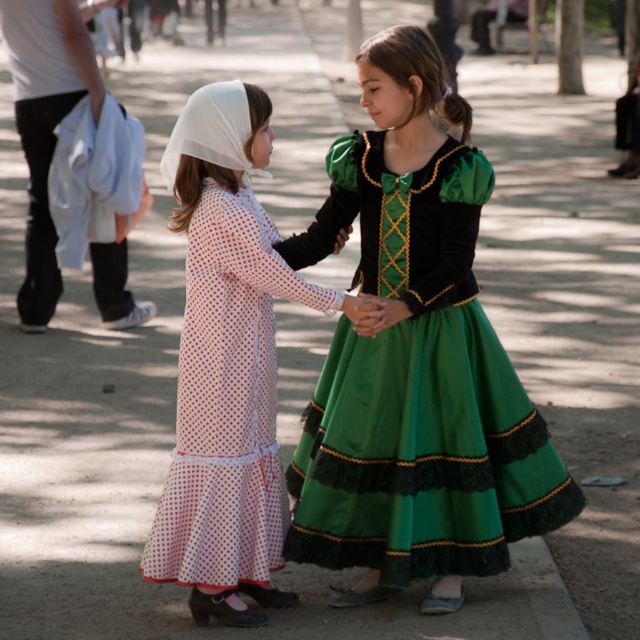
Question: Does green satin dress at center have a greater width compared to white dotted fabric dress at left?

Choices:
 (A) no
 (B) yes

Answer: (B)

Question: Which object is positioned closest to the green satin dress at center?

Choices:
 (A) white dotted fabric dress at left
 (B) white cotton shirt at left

Answer: (A)

Question: Is white dotted fabric dress at left bigger than white cotton shirt at left?

Choices:
 (A) no
 (B) yes

Answer: (A)

Question: Considering the relative positions of green satin dress at center and white dotted fabric dress at left in the image provided, where is green satin dress at center located with respect to white dotted fabric dress at left?

Choices:
 (A) left
 (B) right

Answer: (B)

Question: Which object is closer to the camera taking this photo?

Choices:
 (A) white cotton shirt at left
 (B) green satin dress at center

Answer: (B)

Question: Among these points, which one is farthest from the camera?

Choices:
 (A) (157, 515)
 (B) (472, 160)
 (C) (113, 314)

Answer: (C)